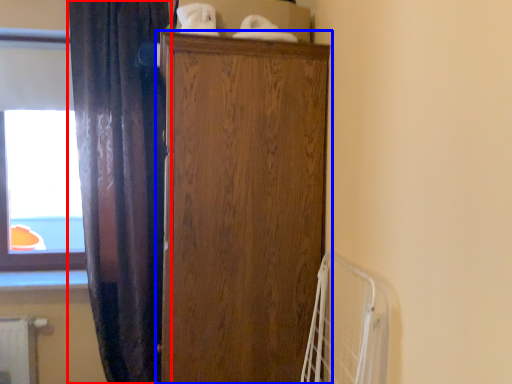
Question: Which point is closer to the camera, curtain (highlighted by a red box) or cupboard (highlighted by a blue box)?

Choices:
 (A) curtain
 (B) cupboard

Answer: (B)